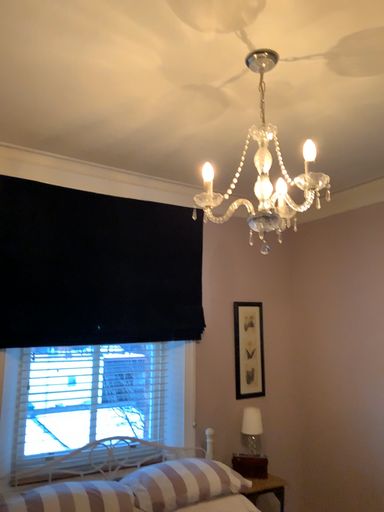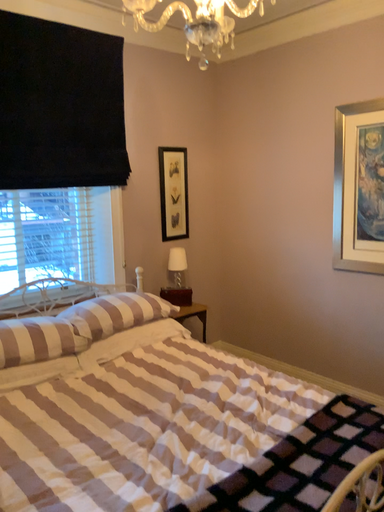
Question: How did the camera likely rotate when shooting the video?

Choices:
 (A) rotated left
 (B) rotated right

Answer: (B)